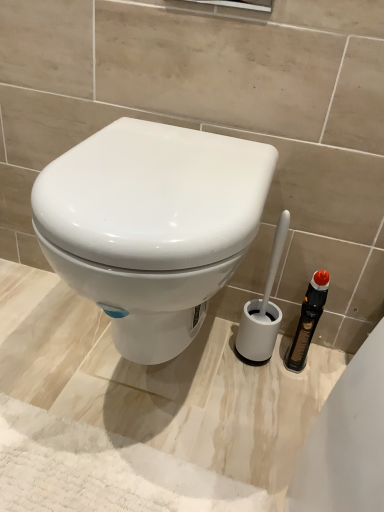
Locate an element on the screen. The height and width of the screenshot is (512, 384). blank space situated above white glossy toilet at center (from a real-world perspective) is located at coordinates (169, 145).